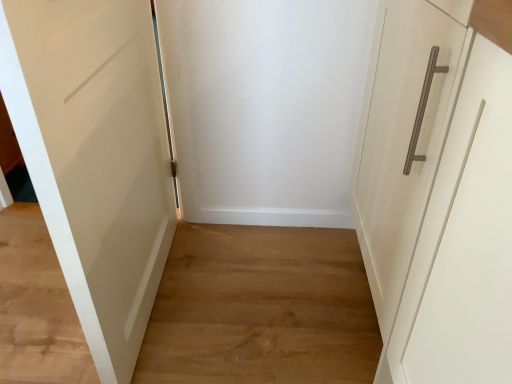
Question: Considering the relative positions of white matte door at left and wooden floor at center in the image provided, is white matte door at left to the left or to the right of wooden floor at center?

Choices:
 (A) right
 (B) left

Answer: (A)

Question: Does point (76, 269) appear closer or farther from the camera than point (201, 235)?

Choices:
 (A) closer
 (B) farther

Answer: (A)

Question: Looking at the image, does white matte door at left seem bigger or smaller compared to wooden floor at center?

Choices:
 (A) big
 (B) small

Answer: (A)

Question: Considering their positions, is wooden floor at center located in front of or behind white matte door at left?

Choices:
 (A) front
 (B) behind

Answer: (B)

Question: Is point (246, 357) positioned closer to the camera than point (112, 9)?

Choices:
 (A) farther
 (B) closer

Answer: (A)

Question: From their relative heights in the image, would you say wooden floor at center is taller or shorter than white matte door at left?

Choices:
 (A) short
 (B) tall

Answer: (A)

Question: In the image, is wooden floor at center on the left side or the right side of white matte door at left?

Choices:
 (A) left
 (B) right

Answer: (A)